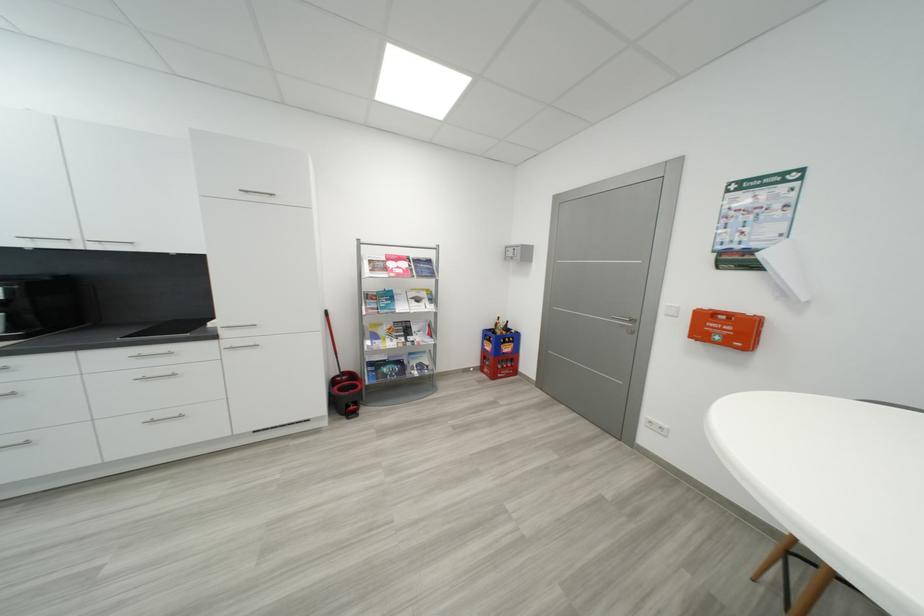
Where is `white light switch`? The height and width of the screenshot is (616, 924). white light switch is located at coordinates (671, 310).